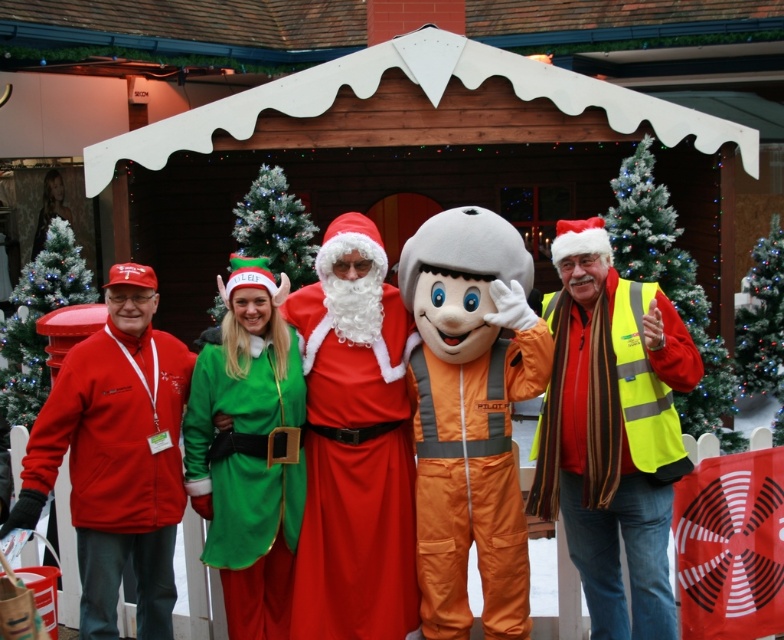
Question: Which point appears closest to the camera in this image?

Choices:
 (A) (372, 545)
 (B) (0, 404)
 (C) (547, 336)
 (D) (245, 456)

Answer: (C)

Question: Does yellow reflective vest at right appear under green felt christmas hat at center?

Choices:
 (A) yes
 (B) no

Answer: (A)

Question: Can you confirm if matte white beard at center is positioned below green matte christmas tree at center?

Choices:
 (A) yes
 (B) no

Answer: (A)

Question: Which point is closer to the camera taking this photo?

Choices:
 (A) (583, 440)
 (B) (766, 269)

Answer: (A)

Question: Is the position of matte red santa at center less distant than that of matte fleece jacket at left?

Choices:
 (A) no
 (B) yes

Answer: (B)

Question: Among these objects, which one is farthest from the camera?

Choices:
 (A) yellow reflective vest at right
 (B) matte white beard at center

Answer: (A)